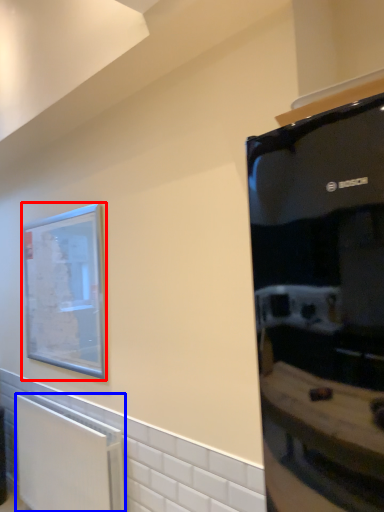
Question: Among these objects, which one is nearest to the camera, picture frame (highlighted by a red box) or radiator (highlighted by a blue box)?

Choices:
 (A) picture frame
 (B) radiator

Answer: (B)